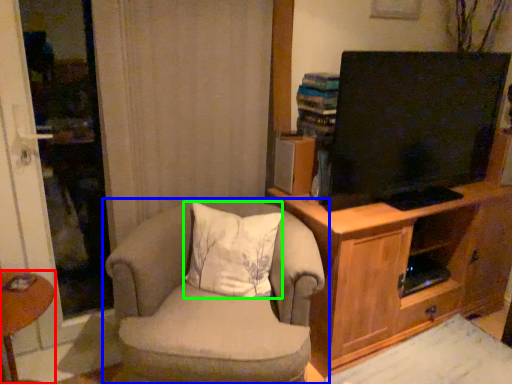
Question: Considering the real-world distances, which object is closest to desk (highlighted by a red box)? chair (highlighted by a blue box) or pillow (highlighted by a green box).

Choices:
 (A) chair
 (B) pillow

Answer: (A)